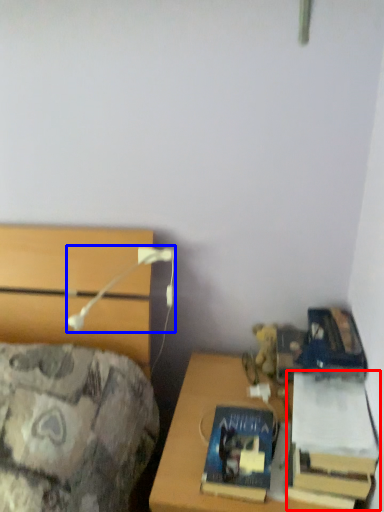
Question: Which object appears farthest to the camera in this image, book (highlighted by a red box) or table lamp (highlighted by a blue box)?

Choices:
 (A) book
 (B) table lamp

Answer: (B)